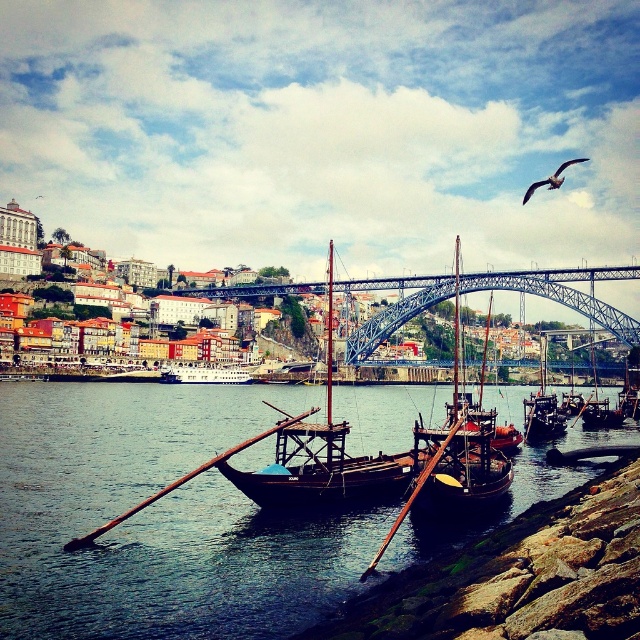
Is the position of blue steel bridge at center less distant than that of wooden boat at center?

No, blue steel bridge at center is further to the viewer.

Is point (506, 289) closer to viewer compared to point (541, 369)?

Yes, it is.

Between point (541, 284) and point (550, 435), which one is positioned in front?

Point (550, 435)

Where is `blue steel bridge at center`? This screenshot has height=640, width=640. blue steel bridge at center is located at coordinates (564, 292).

Between smooth dark water at center and wooden sailboat at center, which one has more height?

Standing taller between the two is wooden sailboat at center.

Is smooth dark water at center to the right of wooden sailboat at center from the viewer's perspective?

In fact, smooth dark water at center is to the left of wooden sailboat at center.

Image resolution: width=640 pixels, height=640 pixels. I want to click on smooth dark water at center, so click(160, 516).

Between wooden boat at center and white glossy boat at center, which one has more height?

Standing taller between the two is wooden boat at center.

Is point (541, 436) more distant than point (224, 371)?

That is False.

What do you see at coordinates (541, 406) in the screenshot? I see `wooden boat at center` at bounding box center [541, 406].

This screenshot has width=640, height=640. Identify the location of wooden boat at center. (541, 406).